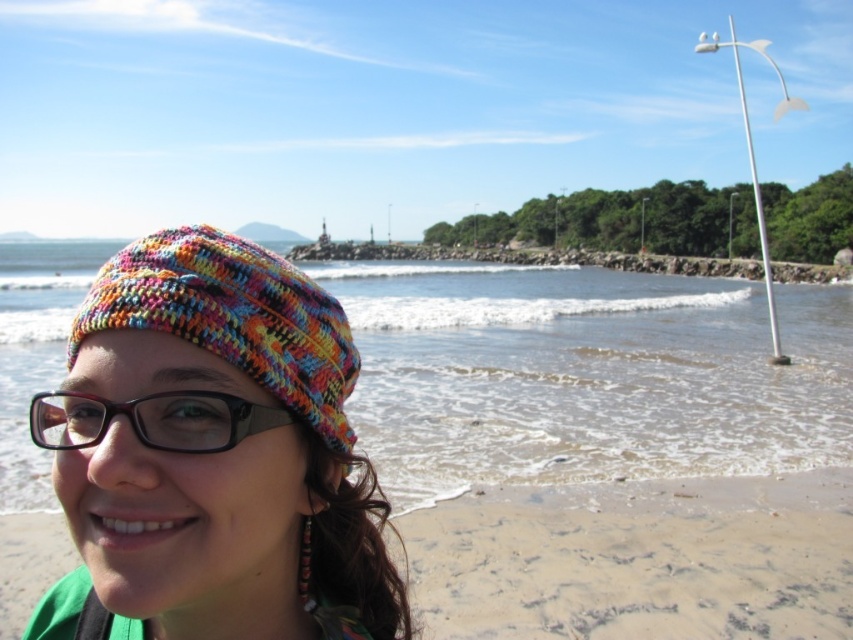
Question: Based on their relative distances, which object is farther from the multicolored knitted hat at center?

Choices:
 (A) multicolored knitted hat at left
 (B) clear water at lower left

Answer: (B)

Question: Considering the relative positions of multicolored knitted hat at left and black plastic glasses at left in the image provided, where is multicolored knitted hat at left located with respect to black plastic glasses at left?

Choices:
 (A) left
 (B) right

Answer: (B)

Question: Is clear water at lower left bigger than black plastic glasses at left?

Choices:
 (A) yes
 (B) no

Answer: (A)

Question: Can you confirm if multicolored knitted hat at center is positioned to the right of black plastic glasses at left?

Choices:
 (A) yes
 (B) no

Answer: (A)

Question: Which point is farther from the camera taking this photo?

Choices:
 (A) (82, 436)
 (B) (148, 292)
 (C) (837, 461)
 (D) (730, 493)

Answer: (C)

Question: Which is farther from the beige sandy beach at lower left?

Choices:
 (A) multicolored knitted hat at left
 (B) clear water at lower left
 (C) black plastic glasses at left

Answer: (B)